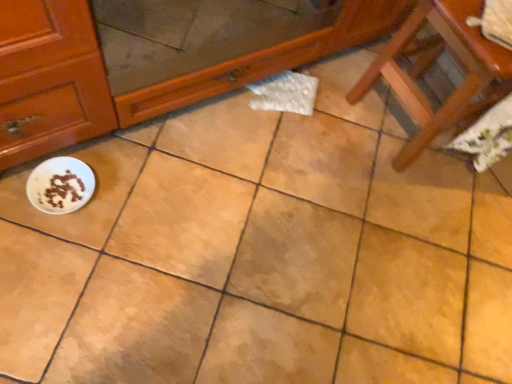
Locate an element on the screen. The height and width of the screenshot is (384, 512). free space between wooden chair at lower right and white glossy bowl at lower left is located at coordinates (246, 166).